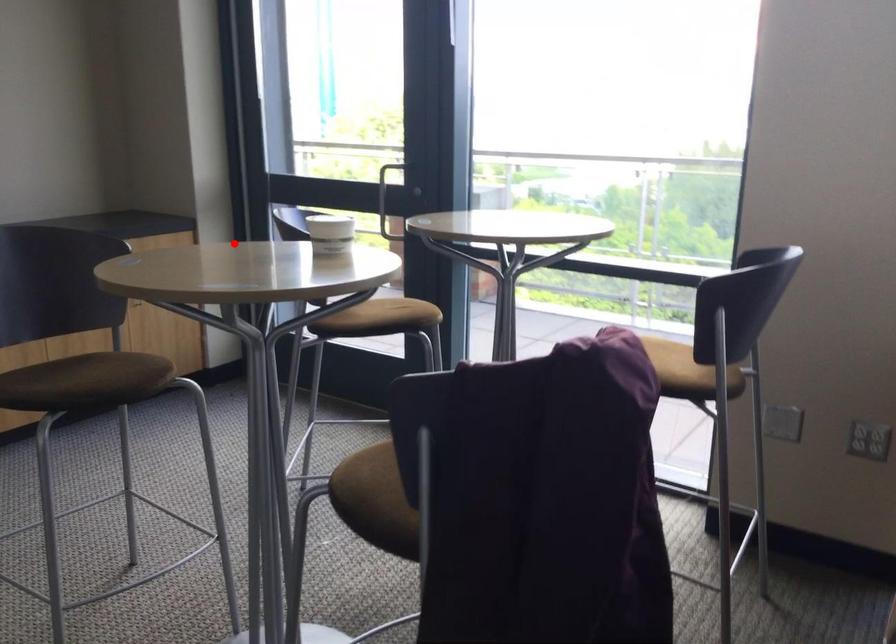
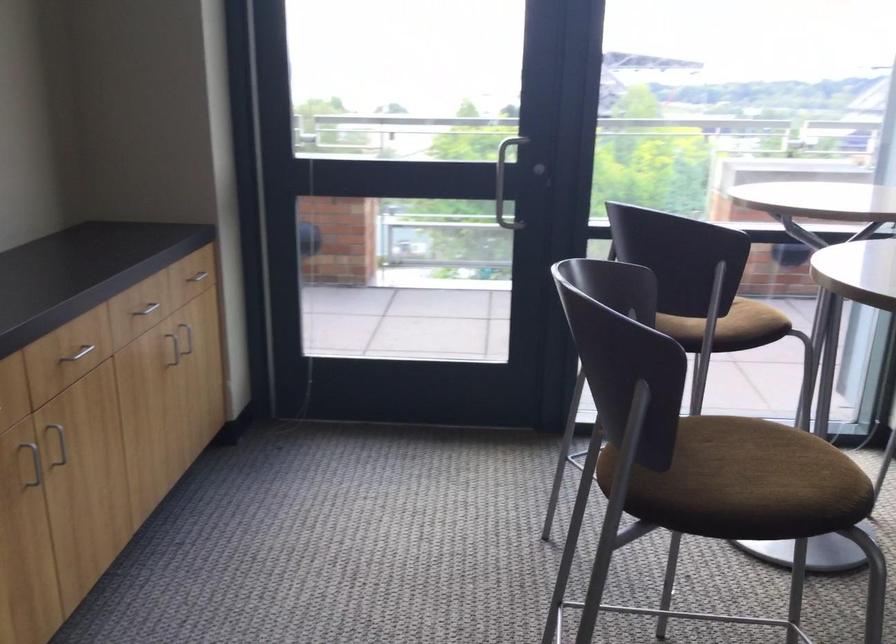
Question: I am providing you with two images of the same scene from different viewpoints. Given a red point in image1, look at the same physical point in image2. Is it:

Choices:
 (A) Closer to the viewpoint
 (B) Farther from the viewpoint

Answer: (A)